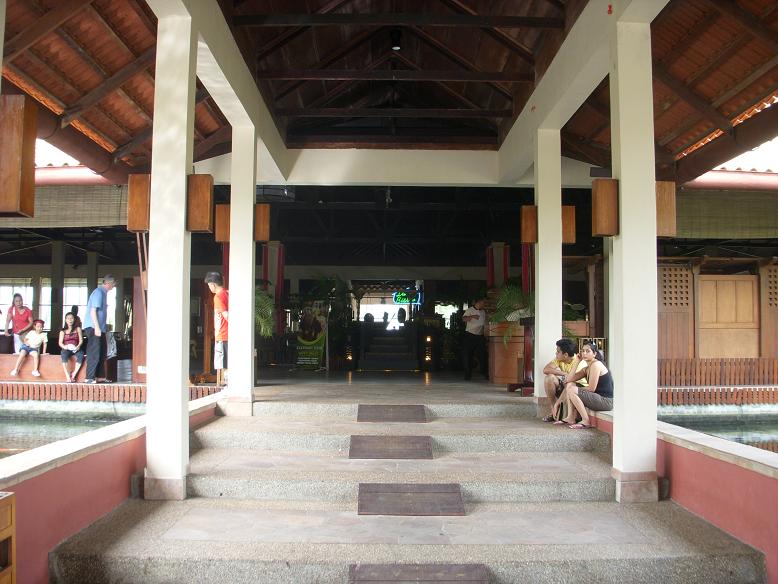
Where is `large wooden plant pot`? The width and height of the screenshot is (778, 584). large wooden plant pot is located at coordinates (506, 369).